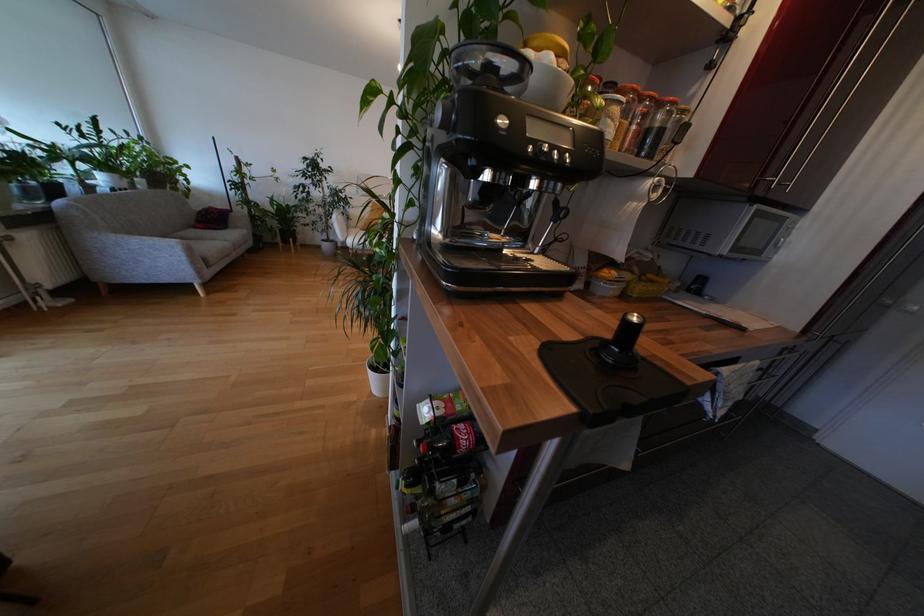
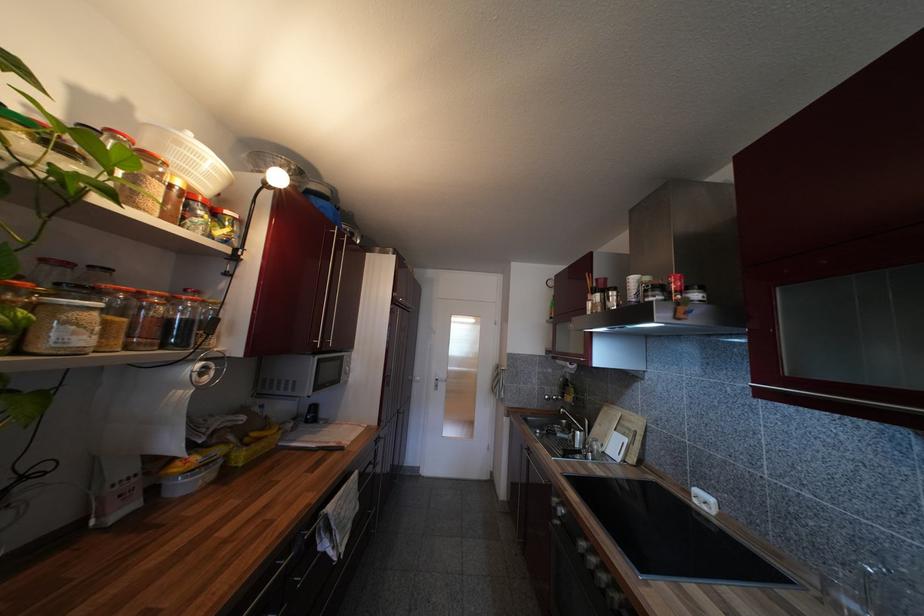
Where in the second image is the point corresponding to (676,105) from the first image?

(198, 302)